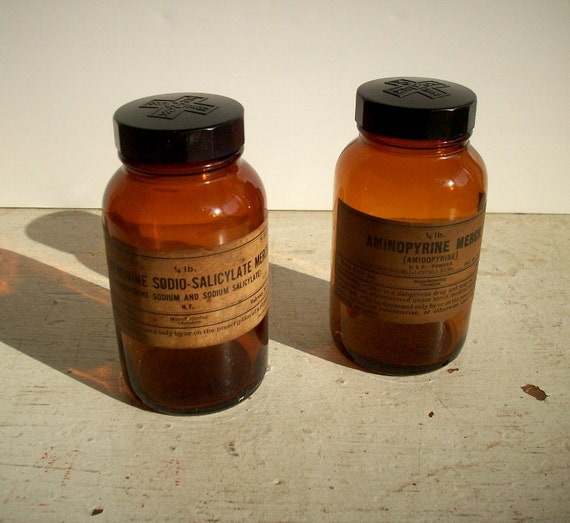
Find the location of a particular element. white shelf is located at coordinates (298, 470).